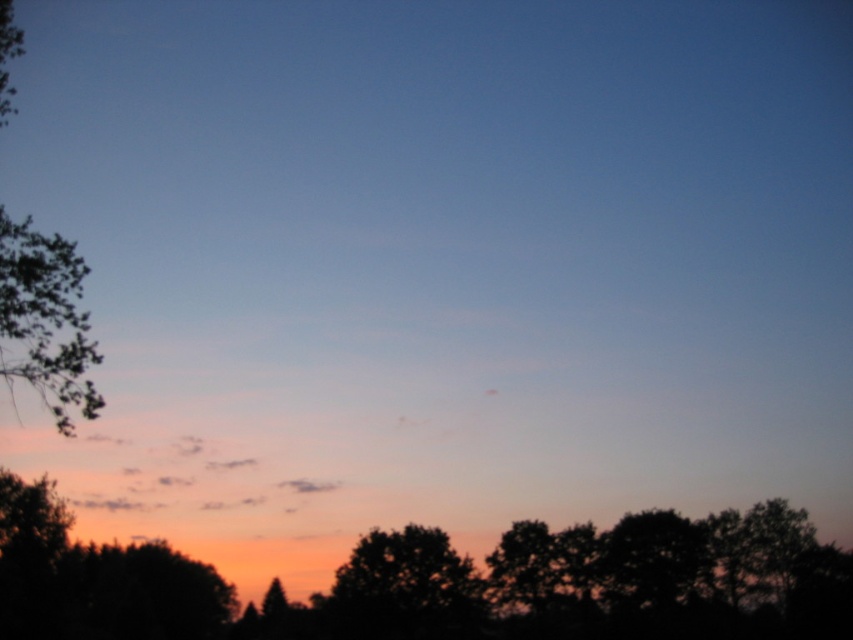
Between green leafy tree at left and silhouette tree at center, which one is positioned higher?

green leafy tree at left

Is point (42, 328) less distant than point (416, 538)?

Yes, point (42, 328) is in front of point (416, 538).

Which is in front, point (16, 353) or point (332, 627)?

Point (16, 353)

The image size is (853, 640). I want to click on green leafy tree at left, so click(45, 321).

Which is below, silhouette tree at lower center or silhouette tree at center?

silhouette tree at center is lower down.

This screenshot has height=640, width=853. What do you see at coordinates (440, 582) in the screenshot?
I see `silhouette tree at lower center` at bounding box center [440, 582].

Locate an element on the screen. The height and width of the screenshot is (640, 853). silhouette tree at lower center is located at coordinates (440, 582).

Can you confirm if silhouette tree at lower center is bigger than green leafy tree at left?

Incorrect, silhouette tree at lower center is not larger than green leafy tree at left.

Between silhouette tree at lower center and green leafy tree at left, which one appears on the left side from the viewer's perspective?

From the viewer's perspective, green leafy tree at left appears more on the left side.

Find the location of a particular element. This screenshot has width=853, height=640. silhouette tree at lower center is located at coordinates (440, 582).

What are the coordinates of `silhouette tree at lower center` in the screenshot? It's located at (440, 582).